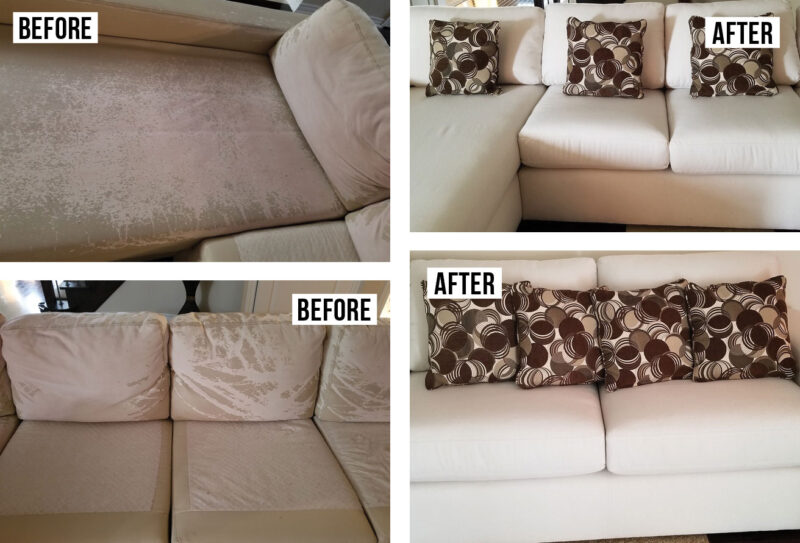
Locate an element on the screen. creme colored couch is located at coordinates (618, 199), (594, 502).